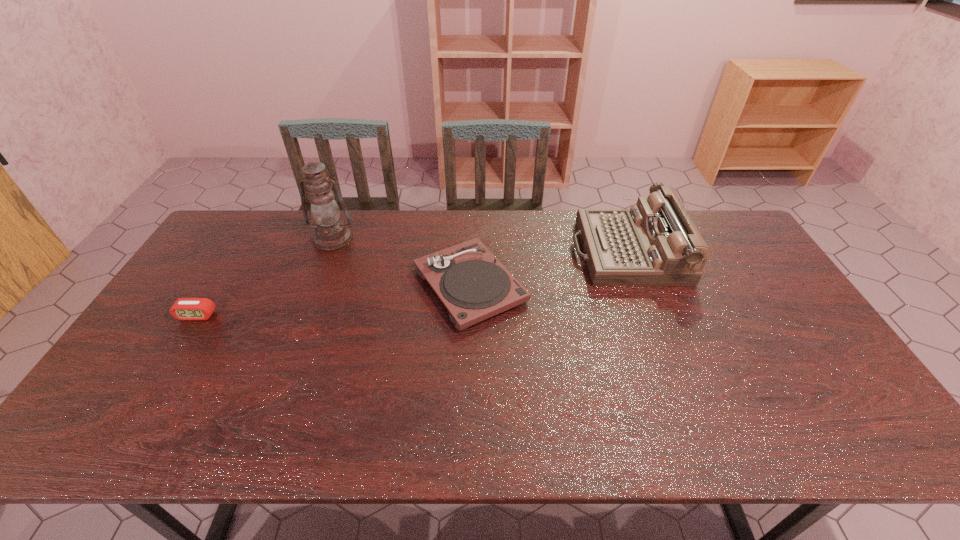
The width and height of the screenshot is (960, 540). I want to click on free space at the left edge, so click(176, 361).

Locate an element on the screen. vacant space at the right edge of the desktop is located at coordinates (759, 325).

You are a GUI agent. You are given a task and a screenshot of the screen. Output one action in this format:
    pyautogui.click(x=<x>, y=<y>)
    Task: Click on the free space at the far right corner
    
    Given the screenshot: What is the action you would take?
    pyautogui.click(x=719, y=240)

Where is `free region at the near right corner of the desktop`? free region at the near right corner of the desktop is located at coordinates (835, 443).

Where is `free space that is in between the phonograph_record and the alarm clock`? The width and height of the screenshot is (960, 540). free space that is in between the phonograph_record and the alarm clock is located at coordinates (333, 300).

At what (x,y) coordinates should I click in order to perform the action: click on unoccupied area between the third object from right to left and the shortest object. Please return your answer as a coordinate pair (x, y). Looking at the image, I should click on (265, 277).

Locate an element on the screen. Image resolution: width=960 pixels, height=540 pixels. vacant space in between the alarm clock and the phonograph_record is located at coordinates (333, 300).

At what (x,y) coordinates should I click in order to perform the action: click on vacant space in between the alarm clock and the oil lamp. Please return your answer as a coordinate pair (x, y). This screenshot has width=960, height=540. Looking at the image, I should click on (265, 277).

I want to click on vacant space that's between the shortest object and the third tallest object, so click(333, 300).

Where is `vacant area that lies between the third object from right to left and the leftmost object`? vacant area that lies between the third object from right to left and the leftmost object is located at coordinates (265, 277).